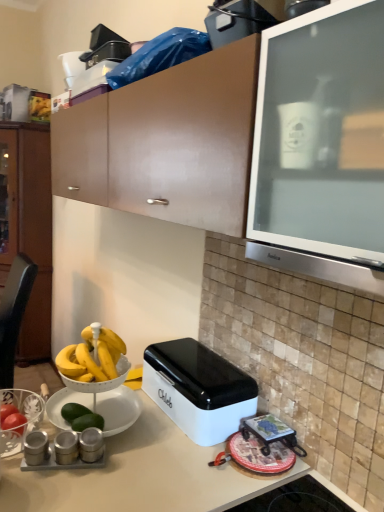
Measure the distance between point [122,41] and camera.

Point [122,41] is 1.60 meters from camera.

This screenshot has width=384, height=512. What do you see at coordinates (63, 465) in the screenshot?
I see `silver metallic spice containers at lower left, which appears as the 6th appliance when viewed from the top` at bounding box center [63, 465].

The image size is (384, 512). What do you see at coordinates (28, 225) in the screenshot?
I see `brown matte cabinet at left` at bounding box center [28, 225].

Measure the distance between point (85, 455) and camera.

Point (85, 455) is 3.64 feet away from camera.

What do you see at coordinates (66, 447) in the screenshot? The height and width of the screenshot is (512, 384). I see `silver metallic salt and pepper shakers at lower left, positioned as the 4th appliance in top-to-bottom order` at bounding box center [66, 447].

Identify the location of white glossy breadbox at lower center. This screenshot has width=384, height=512. (198, 389).

Where is `matte black toaster at upper center, positioned as the 5th appliance in bottom-to-top order`? This screenshot has height=512, width=384. matte black toaster at upper center, positioned as the 5th appliance in bottom-to-top order is located at coordinates (100, 59).

How different are the orientations of white glossy breadbox at lower center and metallic silver canisters at lower left, which is the 1th appliance in front-to-back order, in degrees?

white glossy breadbox at lower center and metallic silver canisters at lower left, which is the 1th appliance in front-to-back order, are facing 65.2 degrees away from each other.

Would you say white glossy breadbox at lower center is inside or outside metallic silver canisters at lower left, positioned as the 3th appliance in top-to-bottom order?

white glossy breadbox at lower center cannot be found inside metallic silver canisters at lower left, positioned as the 3th appliance in top-to-bottom order.

Does white glossy breadbox at lower center have a greater height compared to metallic silver canisters at lower left, which appears as the 4th appliance when ordered from the bottom?

Yes, white glossy breadbox at lower center is taller than metallic silver canisters at lower left, which appears as the 4th appliance when ordered from the bottom.

Identify the location of home appliance on the right of metallic silver canisters at lower left, which is the 1th appliance in front-to-back order. (198, 389).

Between black leather chair at left and white plastic appliance at upper center, which is counted as the first appliance, starting from the top, which one has larger width?

Wider between the two is black leather chair at left.

Which appliance is the 1st one when counting from the right side of the black leather chair at left? Please provide its 2D coordinates.

[(71, 67)]

How much distance is there between black leather chair at left and white plastic appliance at upper center, which is counted as the first appliance, starting from the top?

black leather chair at left and white plastic appliance at upper center, which is counted as the first appliance, starting from the top, are 1.28 meters apart.

Which of these two, black leather chair at left or white plastic appliance at upper center, the sixth appliance in the bottom-to-top sequence, stands shorter?

Standing shorter between the two is white plastic appliance at upper center, the sixth appliance in the bottom-to-top sequence.

Is satin silver canisters at lower left, marked as the 5th appliance in a back-to-front arrangement, outside of matte black toaster at upper center, which appears as the second appliance when viewed from the top?

Indeed, satin silver canisters at lower left, marked as the 5th appliance in a back-to-front arrangement, is completely outside matte black toaster at upper center, which appears as the second appliance when viewed from the top.

Is point (91, 442) more distant than point (103, 67)?

No.

Looking at this image, could you tell me if satin silver canisters at lower left, marked as the 5th appliance in a back-to-front arrangement, is turned towards matte black toaster at upper center, positioned as the 5th appliance in bottom-to-top order?

No, satin silver canisters at lower left, marked as the 5th appliance in a back-to-front arrangement, is not oriented towards matte black toaster at upper center, positioned as the 5th appliance in bottom-to-top order.

Identify the location of home appliance behind the silver metallic spice containers at lower left, which appears as the 6th appliance when viewed from the top. This screenshot has width=384, height=512. (198, 389).

Who is taller, white glossy breadbox at lower center or silver metallic spice containers at lower left, placed as the 1th appliance when sorted from bottom to top?

white glossy breadbox at lower center is taller.

From the image's perspective, is white glossy breadbox at lower center above or below silver metallic spice containers at lower left, placed as the 1th appliance when sorted from bottom to top?

Clearly, from the image's perspective, white glossy breadbox at lower center is above silver metallic spice containers at lower left, placed as the 1th appliance when sorted from bottom to top.

Looking at this image, does white glossy breadbox at lower center have a greater width compared to silver metallic spice containers at lower left, placed as the fourth appliance when sorted from front to back?

Indeed, white glossy breadbox at lower center has a greater width compared to silver metallic spice containers at lower left, placed as the fourth appliance when sorted from front to back.

Between white plastic appliance at upper center, marked as the sixth appliance in a front-to-back arrangement, and black leather chair at left, which one has larger size?

black leather chair at left.

From the image's perspective, is white plastic appliance at upper center, arranged as the first appliance when viewed from the back, located above or below black leather chair at left?

From the image's perspective, white plastic appliance at upper center, arranged as the first appliance when viewed from the back, appears above black leather chair at left.

Is white plastic appliance at upper center, arranged as the first appliance when viewed from the back, positioned beyond the bounds of black leather chair at left?

Yes, white plastic appliance at upper center, arranged as the first appliance when viewed from the back, is located beyond the bounds of black leather chair at left.

How many degrees apart are the facing directions of white plastic appliance at upper center, the sixth appliance in the bottom-to-top sequence, and black leather chair at left?

5.65 degrees.

Considering the sizes of satin silver canisters at lower left, which is the 5th appliance in top-to-bottom order, and brown matte cabinet at left in the image, is satin silver canisters at lower left, which is the 5th appliance in top-to-bottom order, bigger or smaller than brown matte cabinet at left?

In the image, satin silver canisters at lower left, which is the 5th appliance in top-to-bottom order, appears to be smaller than brown matte cabinet at left.

From the picture: Considering the positions of objects satin silver canisters at lower left, marked as the 5th appliance in a back-to-front arrangement, and brown matte cabinet at left in the image provided, who is more to the right, satin silver canisters at lower left, marked as the 5th appliance in a back-to-front arrangement, or brown matte cabinet at left?

Positioned to the right is satin silver canisters at lower left, marked as the 5th appliance in a back-to-front arrangement.

Considering the positions of point (87, 429) and point (40, 213), is point (87, 429) closer or farther from the camera than point (40, 213)?

Clearly, point (87, 429) is closer to the camera than point (40, 213).

Is satin silver canisters at lower left, acting as the 2th appliance starting from the front, not inside brown matte cabinet at left?

satin silver canisters at lower left, acting as the 2th appliance starting from the front, is positioned outside brown matte cabinet at left.

Is silver metallic spice containers at lower left, placed as the 1th appliance when sorted from bottom to top, smaller than satin silver canisters at lower left, acting as the 2th appliance starting from the front?

Indeed, silver metallic spice containers at lower left, placed as the 1th appliance when sorted from bottom to top, has a smaller size compared to satin silver canisters at lower left, acting as the 2th appliance starting from the front.

From a real-world perspective, between silver metallic spice containers at lower left, the 3th appliance from the back, and satin silver canisters at lower left, which is the 5th appliance in top-to-bottom order, who is vertically lower?

In real-world perspective, silver metallic spice containers at lower left, the 3th appliance from the back, is lower.

Considering the positions of objects silver metallic spice containers at lower left, placed as the fourth appliance when sorted from front to back, and satin silver canisters at lower left, acting as the 2th appliance starting from the front, in the image provided, who is more to the right, silver metallic spice containers at lower left, placed as the fourth appliance when sorted from front to back, or satin silver canisters at lower left, acting as the 2th appliance starting from the front,?

From the viewer's perspective, satin silver canisters at lower left, acting as the 2th appliance starting from the front, appears more on the right side.

Looking at their sizes, would you say silver metallic spice containers at lower left, the 3th appliance from the back, is wider or thinner than satin silver canisters at lower left, which is the 5th appliance in top-to-bottom order?

Considering their sizes, silver metallic spice containers at lower left, the 3th appliance from the back, looks slimmer than satin silver canisters at lower left, which is the 5th appliance in top-to-bottom order.

From a real-world perspective, which appliance is the 2nd one underneath the white glossy breadbox at lower center? Please provide its 2D coordinates.

[(36, 447)]

I want to click on chair that is below the white plastic appliance at upper center, which is counted as the first appliance, starting from the top (from the image's perspective), so click(14, 313).

Which object lies nearer to the anchor point brown matte cabinet at left, white glossy breadbox at lower center or metallic silver canisters at lower left, the 6th appliance positioned from the back?

white glossy breadbox at lower center is positioned closer to the anchor brown matte cabinet at left.

Estimate the real-world distances between objects in this image. Which object is further from satin silver canisters at lower left, which ranks as the second appliance in bottom-to-top order, brown matte cabinet at left or silver metallic salt and pepper shakers at lower left, the third appliance ordered from the bottom?

brown matte cabinet at left is further to satin silver canisters at lower left, which ranks as the second appliance in bottom-to-top order.

Which object lies further to the anchor point brown matte cabinet at left, black leather chair at left or silver metallic salt and pepper shakers at lower left, the 3th appliance in the front-to-back sequence?

silver metallic salt and pepper shakers at lower left, the 3th appliance in the front-to-back sequence, is positioned further to the anchor brown matte cabinet at left.

From the image, which object appears to be nearer to metallic silver canisters at lower left, which appears as the 4th appliance when ordered from the bottom, silver metallic spice containers at lower left, placed as the fourth appliance when sorted from front to back, or satin silver canisters at lower left, acting as the 2th appliance starting from the front?

Among the two, silver metallic spice containers at lower left, placed as the fourth appliance when sorted from front to back, is located nearer to metallic silver canisters at lower left, which appears as the 4th appliance when ordered from the bottom.

In the scene shown: Estimate the real-world distances between objects in this image. Which object is further from satin silver canisters at lower left, marked as the 5th appliance in a back-to-front arrangement, white glossy breadbox at lower center or silver metallic salt and pepper shakers at lower left, positioned as the 4th appliance in top-to-bottom order?

Based on the image, white glossy breadbox at lower center appears to be further to satin silver canisters at lower left, marked as the 5th appliance in a back-to-front arrangement.

Considering their positions, is silver metallic spice containers at lower left, placed as the 1th appliance when sorted from bottom to top, positioned closer to matte black toaster at upper center, the fifth appliance positioned from the front, than black leather chair at left?

silver metallic spice containers at lower left, placed as the 1th appliance when sorted from bottom to top, is positioned closer to the anchor matte black toaster at upper center, the fifth appliance positioned from the front.

Looking at the image, which one is located further to matte black toaster at upper center, positioned as the 5th appliance in bottom-to-top order, black leather chair at left or metallic silver canisters at lower left, which appears as the 4th appliance when ordered from the bottom?

black leather chair at left is positioned further to the anchor matte black toaster at upper center, positioned as the 5th appliance in bottom-to-top order.

Which object lies nearer to the anchor point satin silver canisters at lower left, which is the 5th appliance in top-to-bottom order, black leather chair at left or white glossy breadbox at lower center?

white glossy breadbox at lower center lies closer to satin silver canisters at lower left, which is the 5th appliance in top-to-bottom order, than the other object.

You are a GUI agent. You are given a task and a screenshot of the screen. Output one action in this format:
    pyautogui.click(x=<x>, y=<y>)
    Task: Click on the home appliance positioned between silver metallic spice containers at lower left, placed as the fourth appliance when sorted from front to back, and brown matte cabinet at left from near to far
    This screenshot has height=512, width=384.
    Given the screenshot: What is the action you would take?
    pyautogui.click(x=198, y=389)

At what (x,y) coordinates should I click in order to perform the action: click on home appliance between white plastic appliance at upper center, marked as the sixth appliance in a front-to-back arrangement, and silver metallic salt and pepper shakers at lower left, the 3th appliance in the front-to-back sequence, from top to bottom. Please return your answer as a coordinate pair (x, y). Looking at the image, I should click on (198, 389).

Identify the location of chair between matte black toaster at upper center, the fifth appliance positioned from the front, and silver metallic spice containers at lower left, placed as the 1th appliance when sorted from bottom to top, in the up-down direction. (14, 313).

Identify the location of home appliance between matte black toaster at upper center, positioned as the 5th appliance in bottom-to-top order, and black leather chair at left, in the vertical direction. (198, 389).